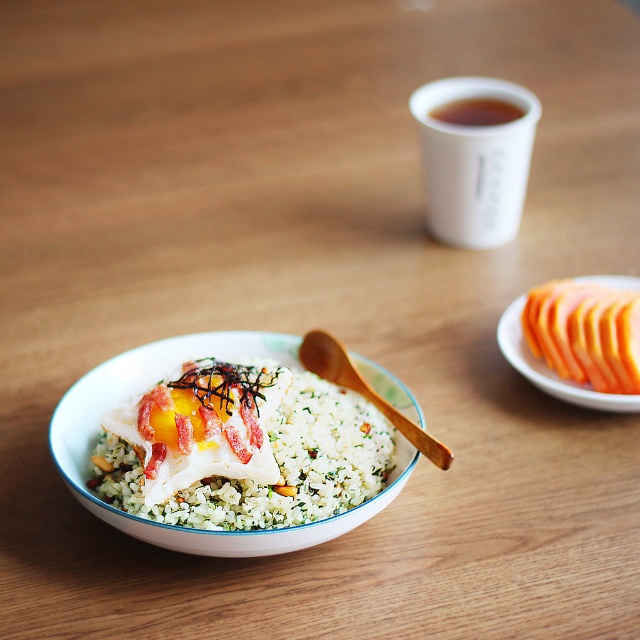
You are setting up a table for a breakfast meal. You have a white matte cup at upper center and a wooden spoon at center. Which item has a greater width?

The white matte cup at upper center has a greater width than the wooden spoon at center.

You are planning to serve a meal and need to arrange the white textured rice at center and the smooth orange slices at right on a plate. Based on their sizes, which one should you place first to ensure they fit well?

The white textured rice at center is larger in size than the smooth orange slices at right, so you should place the white textured rice at center first to accommodate its larger size before arranging the smaller orange slices.